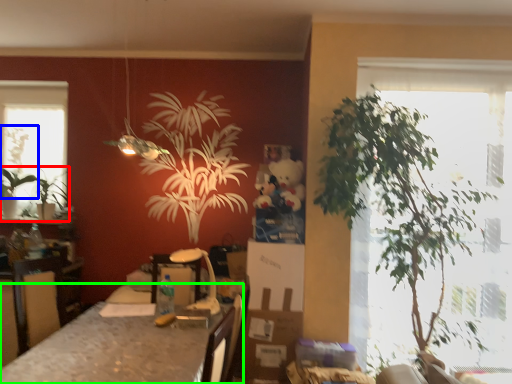
Question: Based on their relative distances, which object is nearer to houseplant (highlighted by a red box)? Choose from plant (highlighted by a blue box) and table (highlighted by a green box).

Choices:
 (A) plant
 (B) table

Answer: (A)